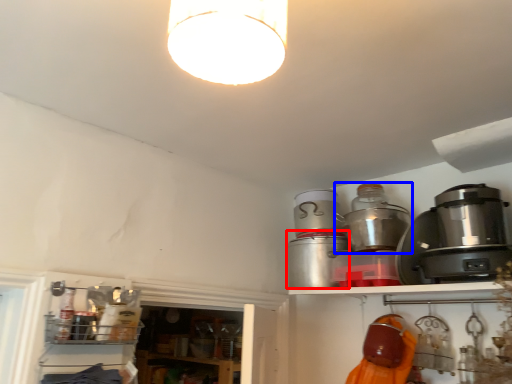
Question: Which of the following is the farthest to the observer, appliance (highlighted by a red box) or appliance (highlighted by a blue box)?

Choices:
 (A) appliance
 (B) appliance

Answer: (A)